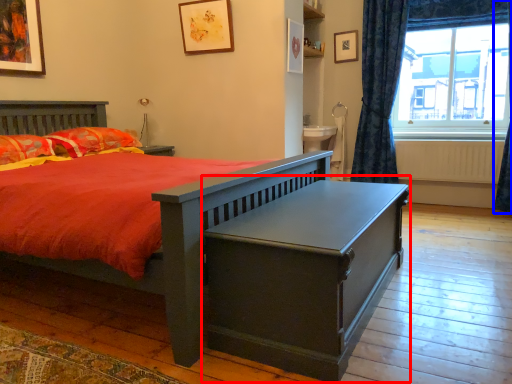
Question: Which point is further to the camera, table (highlighted by a red box) or curtain (highlighted by a blue box)?

Choices:
 (A) table
 (B) curtain

Answer: (B)